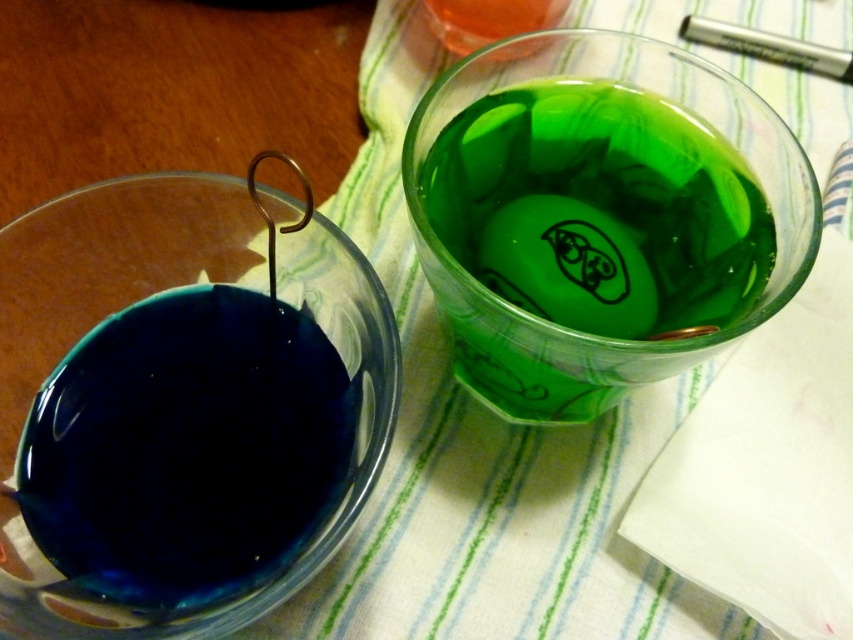
Question: Which object is the closest to the translucent orange liquid at upper center?

Choices:
 (A) transparent blue liquid at left
 (B) green translucent glass at upper right

Answer: (B)

Question: Can you confirm if green translucent glass at upper right is positioned below translucent orange liquid at upper center?

Choices:
 (A) yes
 (B) no

Answer: (A)

Question: Does green translucent glass at upper right appear on the left side of transparent blue liquid at left?

Choices:
 (A) no
 (B) yes

Answer: (A)

Question: Which point appears closest to the camera in this image?

Choices:
 (A) (7, 568)
 (B) (715, 156)

Answer: (A)

Question: Based on their relative distances, which object is farther from the transparent blue liquid at left?

Choices:
 (A) green translucent glass at upper right
 (B) translucent orange liquid at upper center

Answer: (B)

Question: Is green translucent glass at upper right below translucent orange liquid at upper center?

Choices:
 (A) yes
 (B) no

Answer: (A)